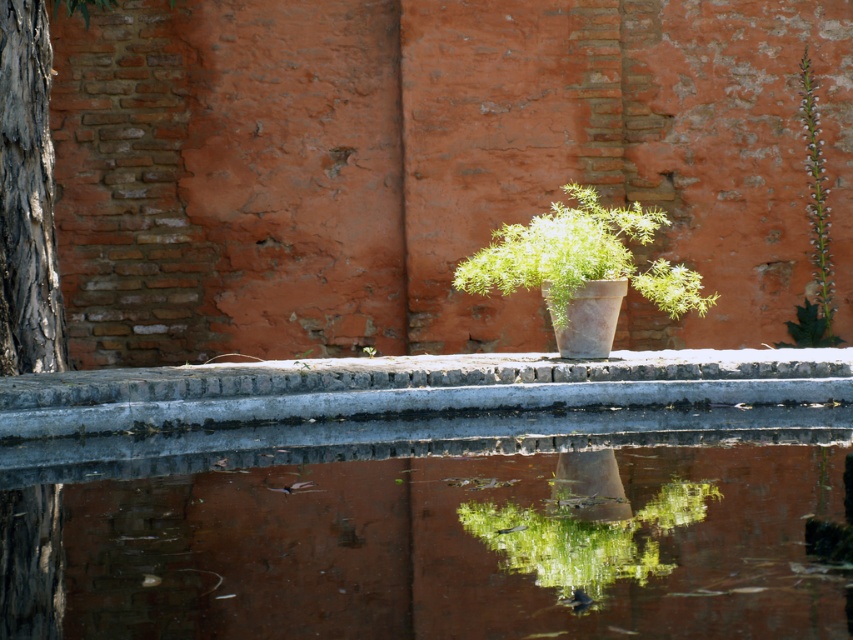
Question: Can you confirm if smooth concrete water at center is smaller than green algae at center?

Choices:
 (A) no
 (B) yes

Answer: (A)

Question: Considering the relative positions of gray bark tree trunk at left and green matte plant at center in the image provided, where is gray bark tree trunk at left located with respect to green matte plant at center?

Choices:
 (A) left
 (B) right

Answer: (A)

Question: Which of the following is the farthest from the observer?

Choices:
 (A) (563, 289)
 (B) (50, 273)
 (C) (108, 595)
 (D) (532, 563)

Answer: (B)

Question: Estimate the real-world distances between objects in this image. Which object is farther from the gray bark tree trunk at left?

Choices:
 (A) green matte plant at center
 (B) smooth concrete water at center
 (C) green algae at center

Answer: (C)

Question: Which point is closer to the camera?

Choices:
 (A) (514, 291)
 (B) (45, 280)
 (C) (619, 552)

Answer: (C)

Question: Is gray bark tree trunk at left further to the viewer compared to green matte plant at center?

Choices:
 (A) yes
 (B) no

Answer: (A)